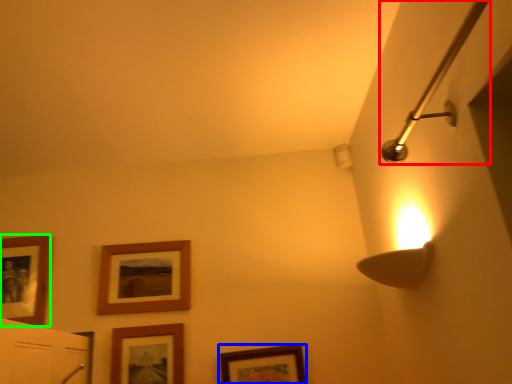
Question: Which object is the farthest from shower (highlighted by a red box)? Choose among these: picture frame (highlighted by a blue box) or picture frame (highlighted by a green box).

Choices:
 (A) picture frame
 (B) picture frame

Answer: (B)